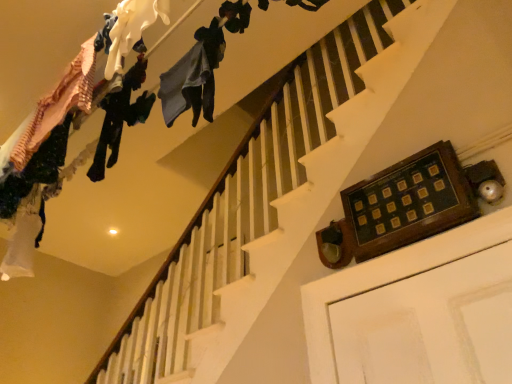
Question: In terms of height, does dark green fabric pants at upper left, which is counted as the third clothing, starting from the right, look taller or shorter compared to matte white fabric at upper left, positioned as the 2th clothing in right-to-left order?

Choices:
 (A) tall
 (B) short

Answer: (A)

Question: In terms of size, does dark green fabric pants at upper left, which is the first clothing in left-to-right order, appear bigger or smaller than matte white fabric at upper left, arranged as the second clothing when viewed from the left?

Choices:
 (A) small
 (B) big

Answer: (B)

Question: Which object is positioned closest to the matte white fabric at upper left, arranged as the second clothing when viewed from the left?

Choices:
 (A) dark green fabric pants at upper left, which is counted as the third clothing, starting from the right
 (B) dark blue fabric at upper center, the first clothing when ordered from right to left

Answer: (B)

Question: Estimate the real-world distances between objects in this image. Which object is closer to the dark green fabric pants at upper left, which is the first clothing in left-to-right order?

Choices:
 (A) dark blue fabric at upper center, the first clothing when ordered from right to left
 (B) matte white fabric at upper left, positioned as the 2th clothing in right-to-left order

Answer: (B)